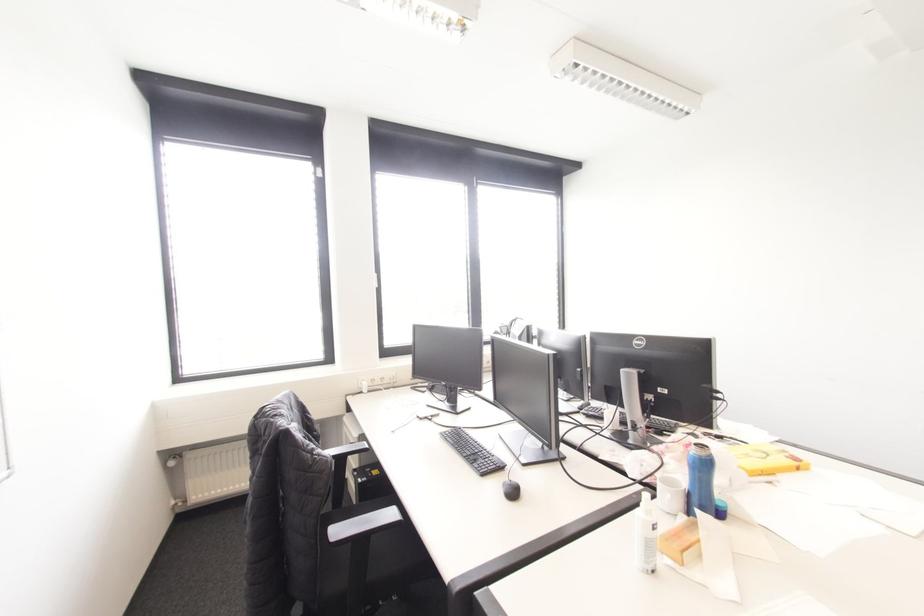
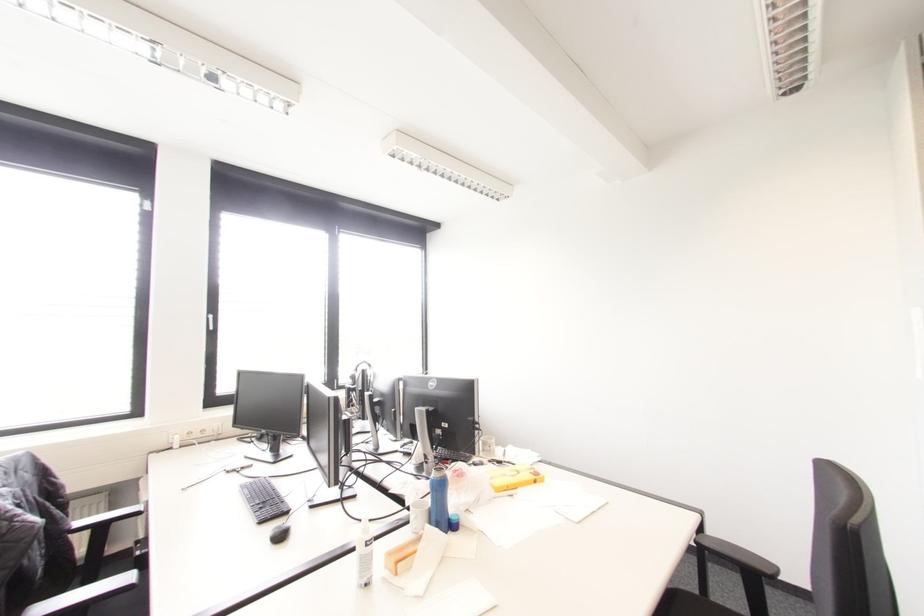
Find the pixel in the second image that matches the point at 650,546 in the first image.

(365, 562)